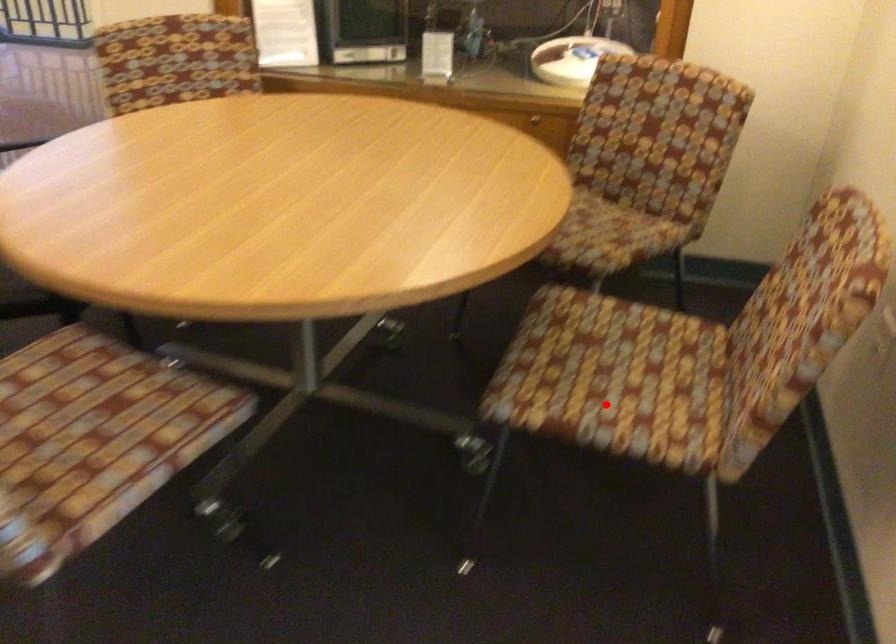
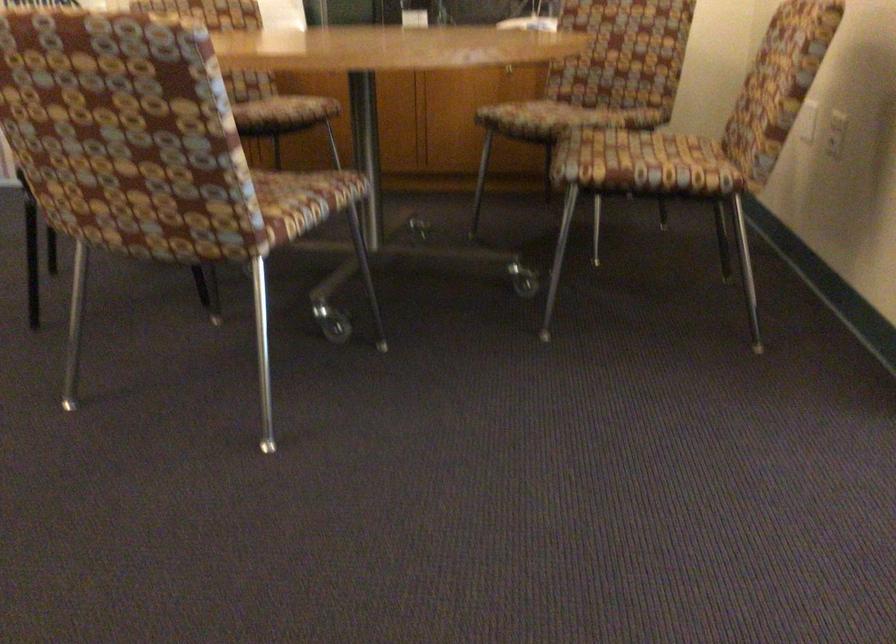
Find the pixel in the second image that matches the highlighted location in the first image.

(643, 164)